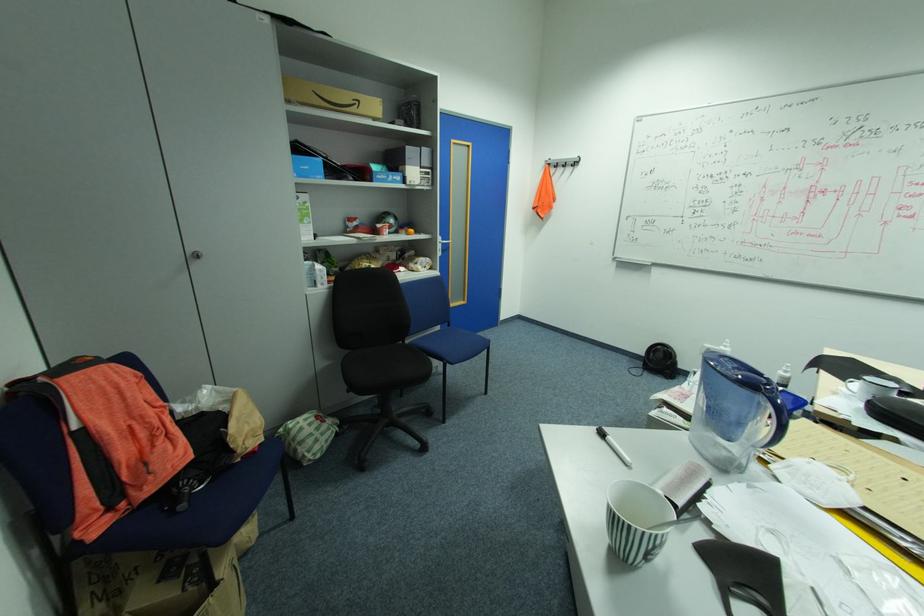
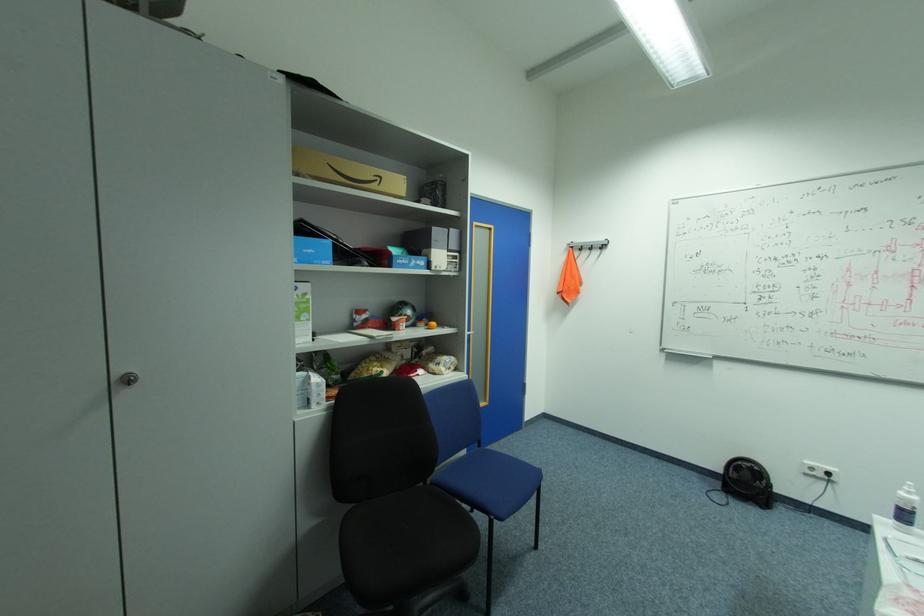
In the second image, find the point that corresponds to the point at 323,177 in the first image.

(331, 262)